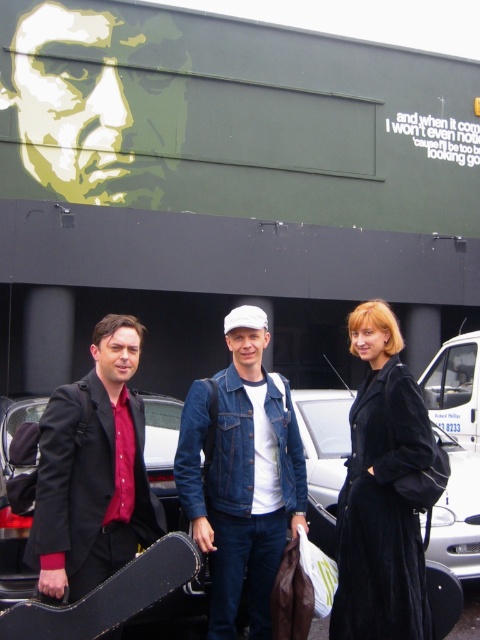
Is point (60, 596) positioned behind point (354, 413)?

No, it is not.

Find the location of `matte black jacket at left`. matte black jacket at left is located at coordinates (94, 472).

Does denim jacket at center have a smaller size compared to velvet black coat at center?

No, denim jacket at center is not smaller than velvet black coat at center.

Is denim jacket at center taller than velvet black coat at center?

Yes.

Who is more forward, (179, 460) or (364, 476)?

Point (364, 476)

The height and width of the screenshot is (640, 480). Identify the location of denim jacket at center. [x=241, y=474].

Does denim jacket at center appear on the left side of matte black jacket at left?

Incorrect, denim jacket at center is not on the left side of matte black jacket at left.

Which is above, denim jacket at center or matte black jacket at left?

matte black jacket at left is above.

Is point (298, 508) less distant than point (128, 486)?

No, it is not.

Image resolution: width=480 pixels, height=640 pixels. I want to click on denim jacket at center, so click(241, 474).